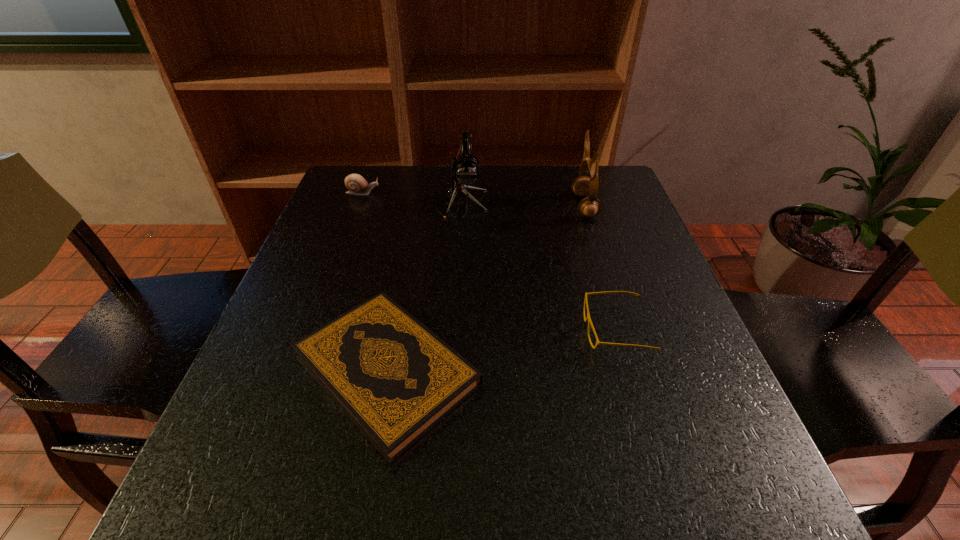
Where is `object located in the far right corner section of the desktop`? This screenshot has width=960, height=540. object located in the far right corner section of the desktop is located at coordinates (589, 207).

In the image, there is a desktop. What are the coordinates of `free space at the far edge` in the screenshot? It's located at (525, 201).

At what (x,y) coordinates should I click in order to perform the action: click on free space at the near edge. Please return your answer as a coordinate pair (x, y). The width and height of the screenshot is (960, 540). Looking at the image, I should click on (325, 490).

Identify the location of vacant area at the left edge of the desktop. (308, 415).

In the image, there is a desktop. In order to click on vacant space at the right edge in this screenshot , I will do `click(662, 340)`.

The width and height of the screenshot is (960, 540). Find the location of `free region at the far left corner`. free region at the far left corner is located at coordinates (368, 178).

Locate an element on the screen. This screenshot has width=960, height=540. blank space at the near left corner is located at coordinates (177, 517).

I want to click on free spot at the far right corner of the desktop, so click(626, 192).

Find the location of a particular element. The image size is (960, 540). vacant area at the near right corner is located at coordinates (678, 474).

This screenshot has height=540, width=960. I want to click on vacant area that lies between the left earphone and the fourth tallest object, so click(x=539, y=267).